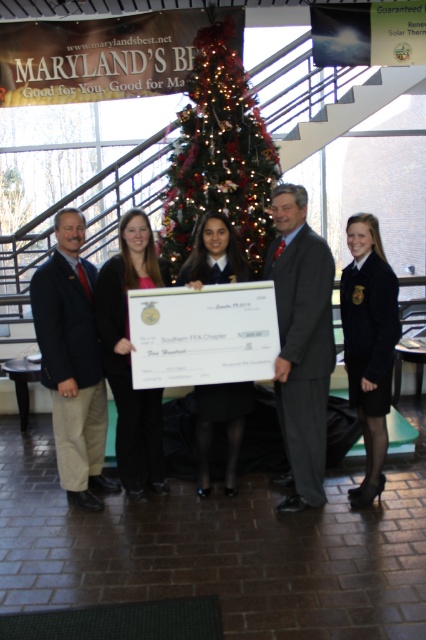
You are a photographer at the event and want to take a photo of the pink fabric shirt at center and the matte black dress at center. The camera you are using has a lens that can focus on objects up to 20 inches apart. Will the two items be within the focus range of the camera?

The pink fabric shirt at center and the matte black dress at center are 20.96 inches apart. Since the camera can focus on objects up to 20 inches apart, the distance between them exceeds the focus range. Therefore, the camera may not be able to focus on both items simultaneously.

You are a photographer at the event and need to adjust the lighting so that both the navy blue suit at center and the matte black dress at center are equally visible. Considering their heights, which one might require more upward or downward angle adjustments?

The navy blue suit at center is much taller than the matte black dress at center, so the photographer would need to angle the camera downward slightly to capture the navy blue suit at center and upward for the matte black dress at center to ensure both are equally visible.

You are organizing a photo shoot and need to ensure that the shiny red christmas tree at center and the black uniform at right are both visible in the frame. Based on their sizes, which object might require more space in the background to accommodate its width?

The shiny red christmas tree at center might require more space in the background to accommodate its width since it is wider than the black uniform at right.